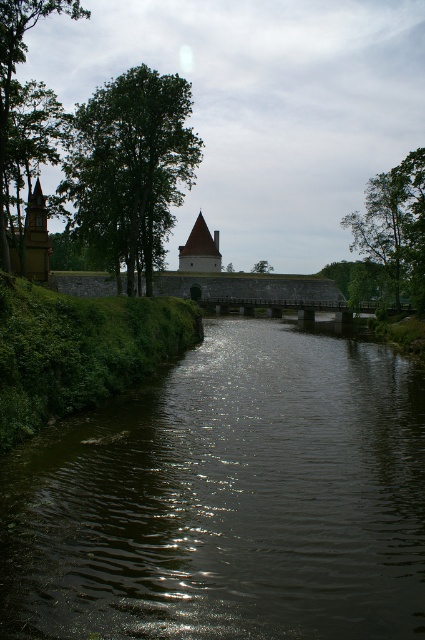
You are an environmental scientist examining the image. You need to determine the spatial arrangement of the green leafy tree at upper left and the green leafy tree at center. Which tree is located to the left of the other?

The green leafy tree at upper left is positioned on the left side of green leafy tree at center.

You are an architect designing a new garden path that must pass between the green leafy tree at upper left and the green leafy tree at center. Considering their sizes, which tree will require more space to avoid damaging its roots?

The green leafy tree at upper left has a larger size compared to the green leafy tree at center, so it will require more space to avoid damaging its roots.